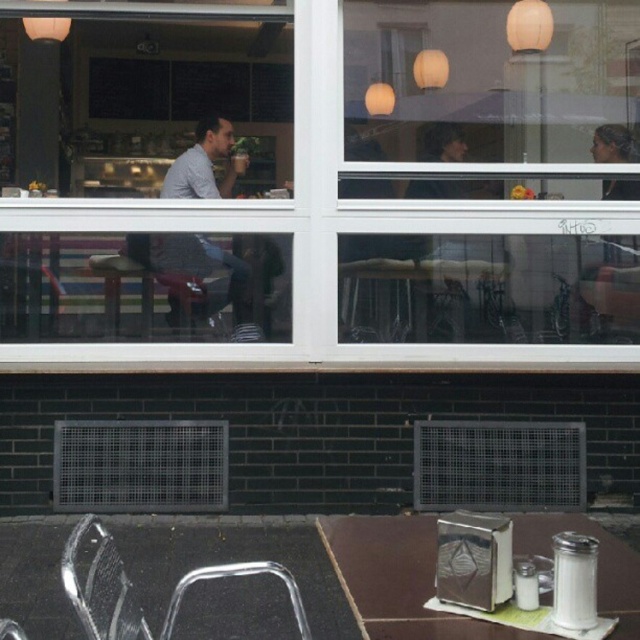
You are a customer entering the cafe and want to sit down. You see the matte gray shirt at left and the metallic silver chair at lower left. Which object is closer to you from your current position?

The metallic silver chair at lower left is closer to you because it is located below the matte gray shirt at left, which is positioned above it in the image.

You are setting up a small table for a customer at the cafe. The table has a metallic silver napkin holder at center and a metallic silver chair at lower left. You need to place a decorative plate between them. Which object should the plate be closer to if the napkin holder is wider than the chair?

The metallic silver napkin holder at center is wider than the metallic silver chair at lower left, so the decorative plate should be placed closer to the chair to balance the width difference.

Looking at this image, you are a delivery person with a box that measures 12 feet in length. You need to place this box between the matte gray shirt at left and the metallic silver chair at lower left. Is there enough space to fit the box between them?

The distance between the matte gray shirt at left and the metallic silver chair at lower left is 11.82 feet. Since the box is 12 feet long, it is slightly too long to fit in the available space.